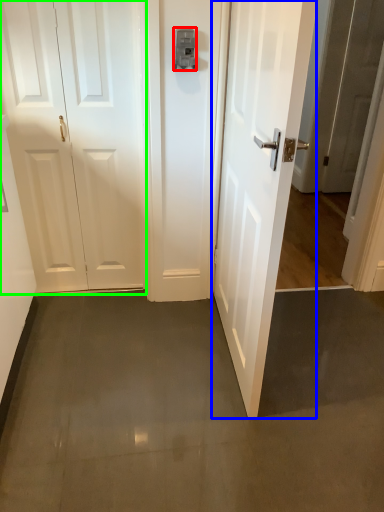
Question: Which object is the farthest from latch (highlighted by a red box)? Choose among these: door (highlighted by a blue box) or door (highlighted by a green box).

Choices:
 (A) door
 (B) door

Answer: (A)